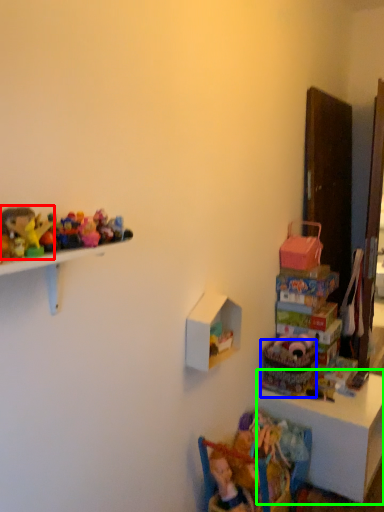
Question: Estimate the real-world distances between objects in this image. Which object is farther from toy (highlighted by a red box), basket (highlighted by a blue box) or table (highlighted by a green box)?

Choices:
 (A) basket
 (B) table

Answer: (B)